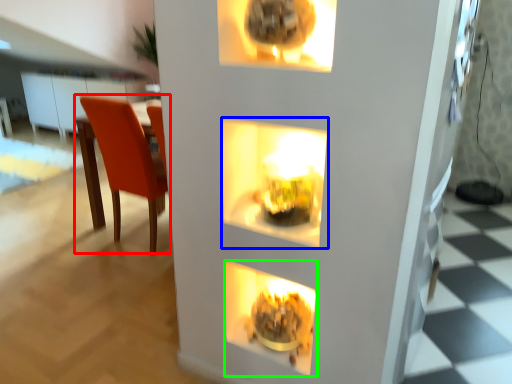
Question: Which object is positioned closest to chair (highlighted by a red box)? Select from shelf (highlighted by a blue box) and fireplace (highlighted by a green box).

Choices:
 (A) shelf
 (B) fireplace

Answer: (A)